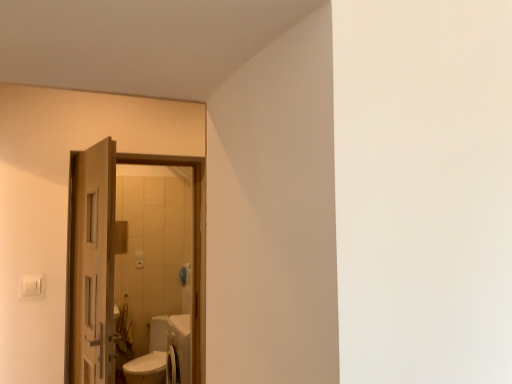
Question: Is wooden door at left, the first door when ordered from back to front, situated inside wooden door at left, positioned as the second door in back-to-front order, or outside?

Choices:
 (A) inside
 (B) outside

Answer: (B)

Question: Is point (98, 379) closer or farther from the camera than point (88, 165)?

Choices:
 (A) farther
 (B) closer

Answer: (B)

Question: Visually, is wooden door at left, the first door when ordered from back to front, positioned to the left or to the right of wooden door at left, placed as the 1th door when sorted from front to back?

Choices:
 (A) right
 (B) left

Answer: (B)

Question: Is wooden door at left, placed as the 1th door when sorted from front to back, situated inside wooden door at left, marked as the second door in a front-to-back arrangement, or outside?

Choices:
 (A) outside
 (B) inside

Answer: (A)

Question: From a real-world perspective, is wooden door at left, positioned as the second door in back-to-front order, positioned above or below wooden door at left, the first door when ordered from back to front?

Choices:
 (A) above
 (B) below

Answer: (A)

Question: Is wooden door at left, placed as the 1th door when sorted from front to back, wider or thinner than wooden door at left, the first door when ordered from back to front?

Choices:
 (A) wide
 (B) thin

Answer: (B)

Question: Considering the positions of wooden door at left, positioned as the second door in back-to-front order, and wooden door at left, the first door when ordered from back to front, in the image, is wooden door at left, positioned as the second door in back-to-front order, taller or shorter than wooden door at left, the first door when ordered from back to front,?

Choices:
 (A) short
 (B) tall

Answer: (A)